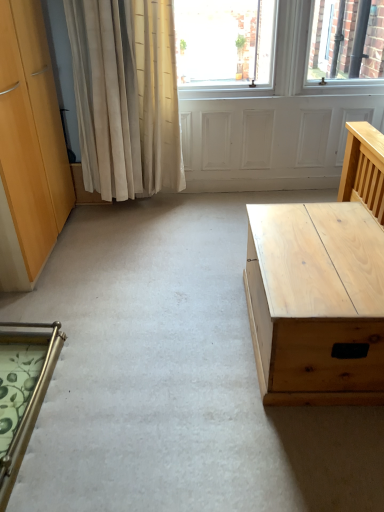
Question: Is gold metallic chair at lower left surrounding light wood/texture desk at right?

Choices:
 (A) no
 (B) yes

Answer: (A)

Question: Is gold metallic chair at lower left completely or partially outside of light wood/texture desk at right?

Choices:
 (A) yes
 (B) no

Answer: (A)

Question: Could you tell me if gold metallic chair at lower left is facing light wood/texture desk at right?

Choices:
 (A) yes
 (B) no

Answer: (A)

Question: Considering the relative sizes of gold metallic chair at lower left and light wood/texture desk at right in the image provided, is gold metallic chair at lower left bigger than light wood/texture desk at right?

Choices:
 (A) no
 (B) yes

Answer: (A)

Question: Is gold metallic chair at lower left closer to camera compared to light wood/texture desk at right?

Choices:
 (A) yes
 (B) no

Answer: (A)

Question: Is gold metallic chair at lower left thinner than light wood/texture desk at right?

Choices:
 (A) yes
 (B) no

Answer: (A)

Question: From the image's perspective, does light wood/texture desk at right appear lower than gold metallic chair at lower left?

Choices:
 (A) no
 (B) yes

Answer: (A)

Question: Is light wood/texture desk at right turned away from gold metallic chair at lower left?

Choices:
 (A) no
 (B) yes

Answer: (A)

Question: Does light wood/texture desk at right have a lesser width compared to gold metallic chair at lower left?

Choices:
 (A) yes
 (B) no

Answer: (B)

Question: From the image's perspective, is light wood/texture desk at right on top of gold metallic chair at lower left?

Choices:
 (A) yes
 (B) no

Answer: (A)

Question: Is light wood/texture desk at right to the right of gold metallic chair at lower left from the viewer's perspective?

Choices:
 (A) yes
 (B) no

Answer: (A)

Question: Can you confirm if light wood/texture desk at right is shorter than gold metallic chair at lower left?

Choices:
 (A) no
 (B) yes

Answer: (A)

Question: Is light wood/texture desk at right in front of or behind gold metallic chair at lower left in the image?

Choices:
 (A) behind
 (B) front

Answer: (A)